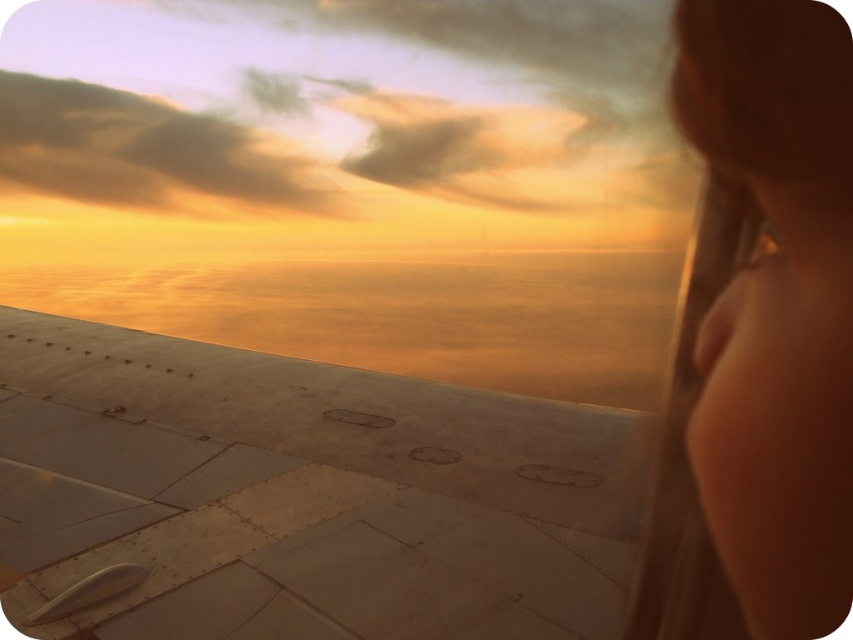
Question: Does smooth skin face at upper right have a smaller size compared to cloudy orange sky at upper left?

Choices:
 (A) no
 (B) yes

Answer: (B)

Question: Is metallic gray wing at lower left bigger than cloudy orange sky at upper left?

Choices:
 (A) no
 (B) yes

Answer: (A)

Question: Can you confirm if smooth skin face at upper right is positioned above cloudy orange sky at upper left?

Choices:
 (A) no
 (B) yes

Answer: (A)

Question: Considering the real-world distances, which object is farthest from the metallic gray wing at lower left?

Choices:
 (A) smooth skin face at upper right
 (B) cloudy orange sky at upper left

Answer: (B)

Question: Among these objects, which one is nearest to the camera?

Choices:
 (A) cloudy orange sky at upper left
 (B) metallic gray wing at lower left

Answer: (B)

Question: Which object is positioned farthest from the cloudy orange sky at upper left?

Choices:
 (A) smooth skin face at upper right
 (B) metallic gray wing at lower left

Answer: (A)